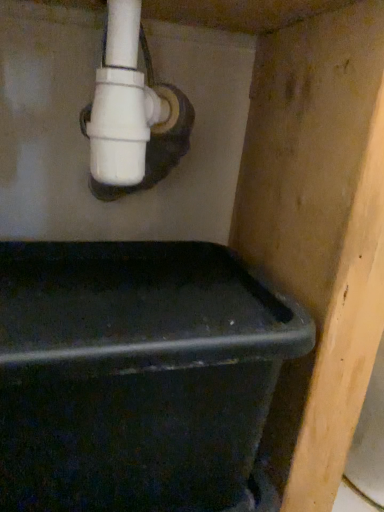
What is the approximate width of black plastic bin at lower left?

black plastic bin at lower left is 11.53 inches wide.

I want to click on black plastic bin at lower left, so click(x=137, y=376).

Image resolution: width=384 pixels, height=512 pixels. Describe the element at coordinates (137, 376) in the screenshot. I see `black plastic bin at lower left` at that location.

The height and width of the screenshot is (512, 384). I want to click on black plastic bin at lower left, so click(x=137, y=376).